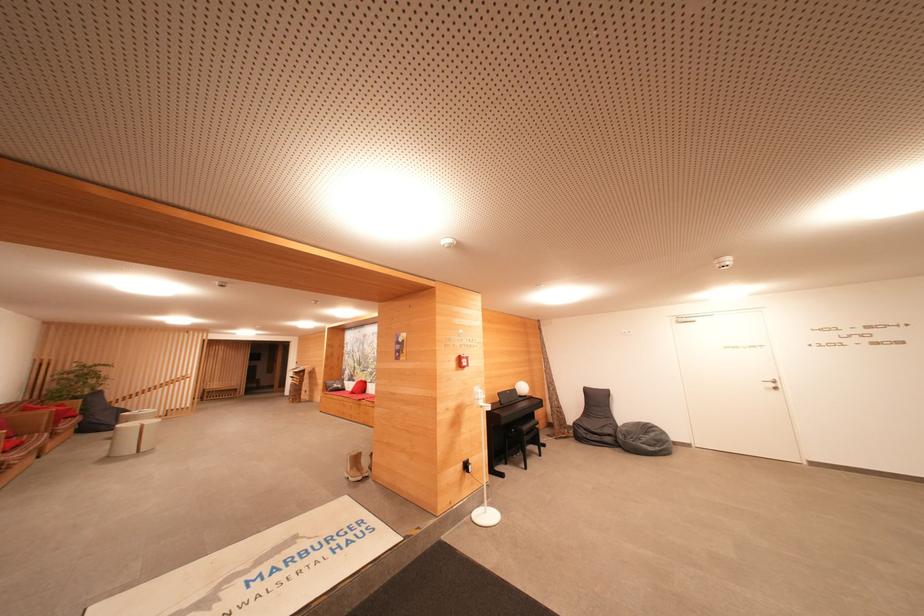
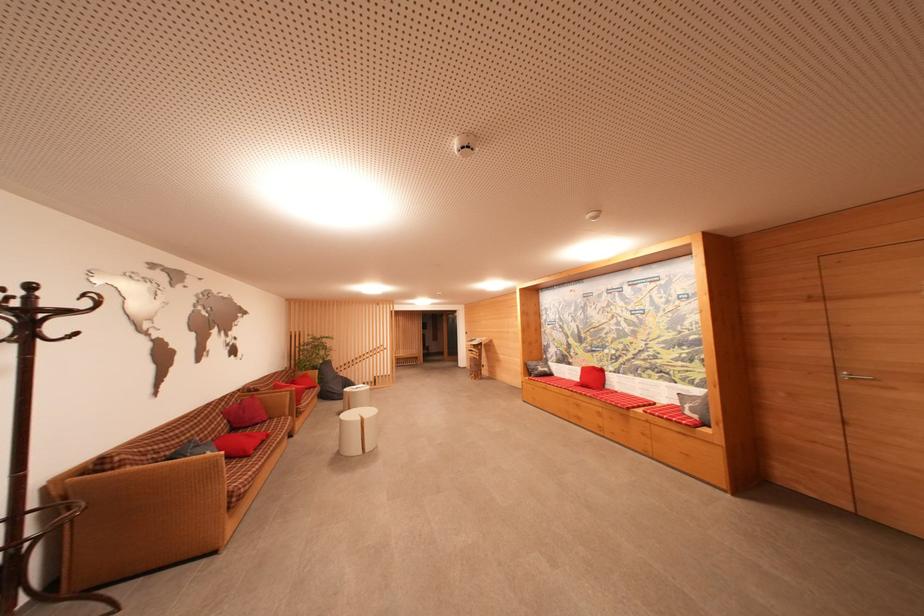
Where in the second image is the point corresponding to (339,389) from the first image?

(544, 371)